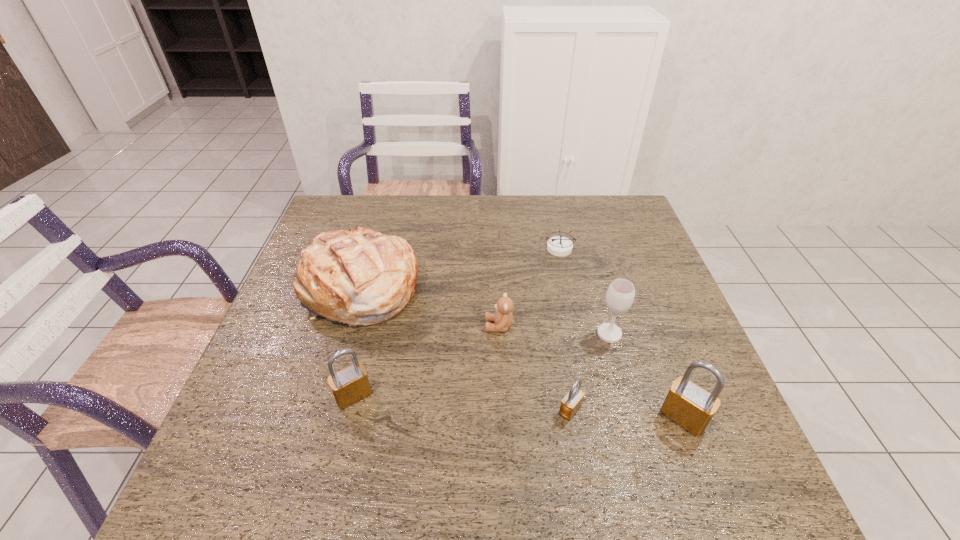
At what (x,y) coordinates should I click in order to perform the action: click on free space that satisfies the following two spatial constraints: 1. on the face of the third object from left to right; 2. on the back side of the rightmost object. Please return your answer as a coordinate pair (x, y). This screenshot has width=960, height=540. Looking at the image, I should click on (503, 417).

Find the location of a particular element. The width and height of the screenshot is (960, 540). vacant space that satisfies the following two spatial constraints: 1. on the face of the wineglass; 2. on the left side of the teddy bear is located at coordinates (499, 334).